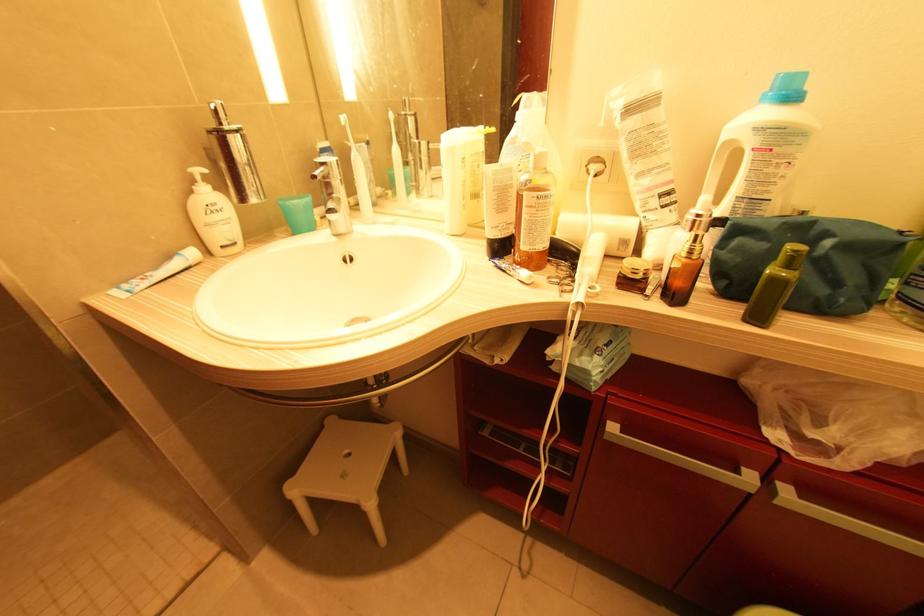
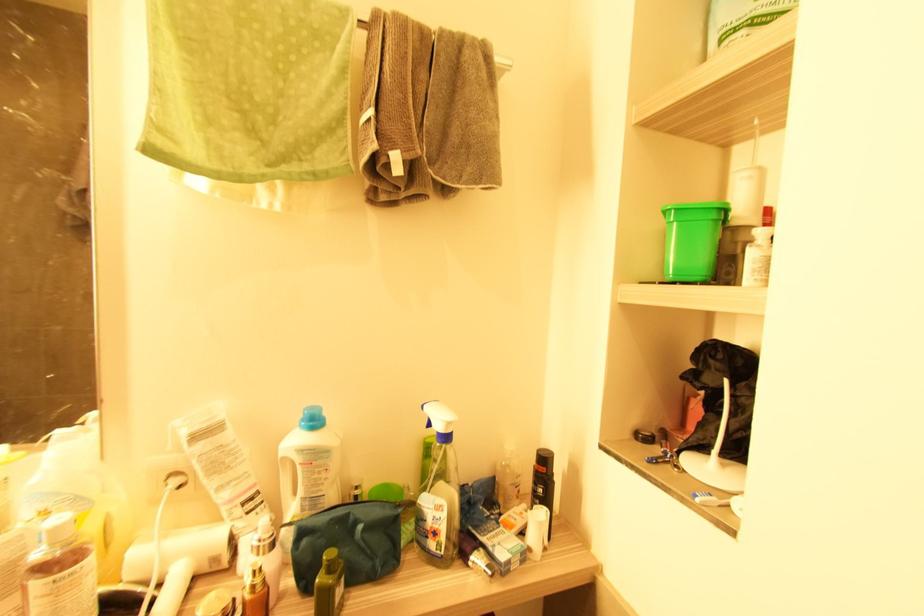
The point at (625, 244) is marked in the first image. Where is the corresponding point in the second image?

(216, 561)